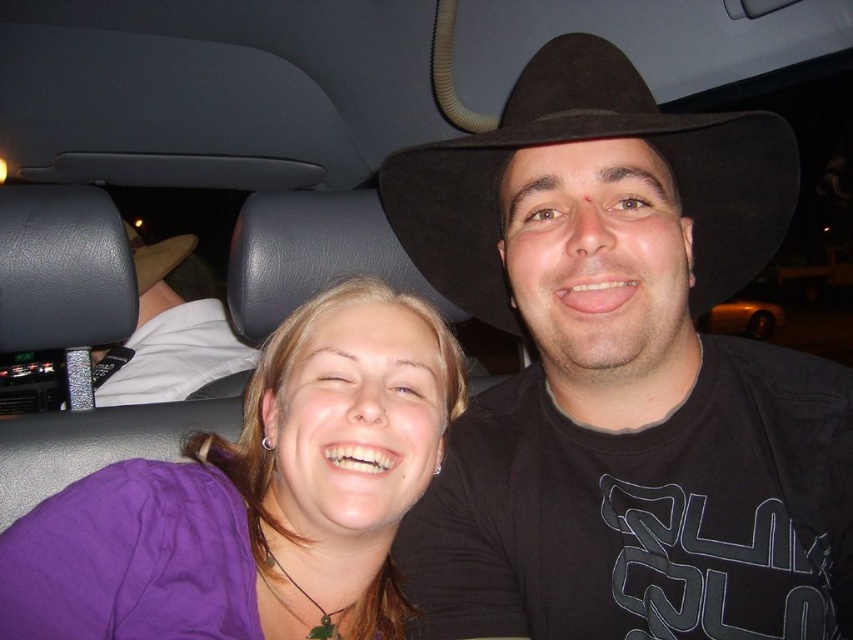
You are a photographer trying to capture a closeup of the black felt fedora at center and the white fabric shirt at upper left. Which object should you focus on first if you want to ensure both are in focus without moving the camera?

The black felt fedora at center is positioned on the right side of white fabric shirt at upper left, so you should focus on the white fabric shirt at upper left first since it is closer to the camera.

You are a delivery robot that needs to place a package between the black felt hat at upper right and the brown felt hat at upper center in a car. The package measures 1 meter in length. Will the package fit between them?

The distance between the black felt hat at upper right and the brown felt hat at upper center is 84.25 centimeters. Since the package is 1 meter long, which is longer than the available space, the package will not fit between them.

You are designing a storage box for the car that needs to accommodate both the white fabric shirt at upper left and the brown felt hat at upper center. Based on their sizes, which object requires more horizontal space in the box?

The white fabric shirt at upper left requires more horizontal space in the box because its width is larger than the brown felt hat at upper center.